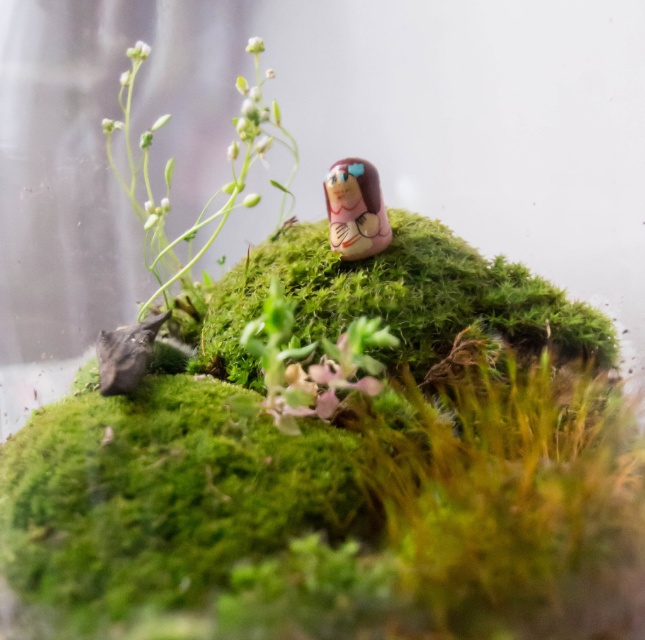
Does green matte plant at upper left have a greater width compared to matte pink figurine at center?

Indeed, green matte plant at upper left has a greater width compared to matte pink figurine at center.

Measure the distance between point (110, 118) and camera.

1.53 meters

Between point (241, 88) and point (370, 193), which one is positioned behind?

Positioned behind is point (241, 88).

Image resolution: width=645 pixels, height=640 pixels. I want to click on green matte plant at upper left, so click(174, 164).